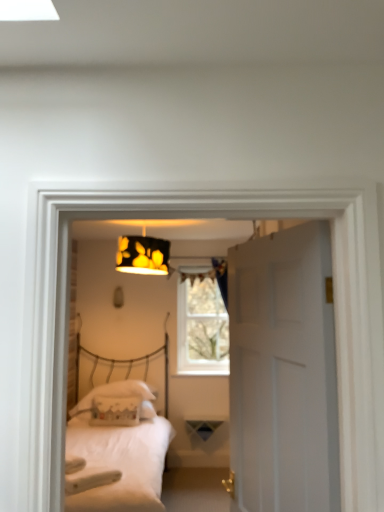
Question: Is white fabric pillow at center, the first pillow from the front, outside white matte door at center?

Choices:
 (A) yes
 (B) no

Answer: (A)

Question: Can you confirm if white fabric pillow at center, the first pillow from the front, is shorter than white matte door at center?

Choices:
 (A) yes
 (B) no

Answer: (A)

Question: Does white fabric pillow at center, the second pillow in the back-to-front sequence, turn towards white matte door at center?

Choices:
 (A) yes
 (B) no

Answer: (A)

Question: Is white matte door at center located within white fabric pillow at center, the second pillow in the back-to-front sequence?

Choices:
 (A) yes
 (B) no

Answer: (B)

Question: Is white fabric pillow at center, the second pillow in the back-to-front sequence, looking in the opposite direction of white matte door at center?

Choices:
 (A) yes
 (B) no

Answer: (B)

Question: Considering the positions of black paper lampshade at upper center and white fabric pillow at center, the 1th pillow when ordered from back to front, in the image, is black paper lampshade at upper center wider or thinner than white fabric pillow at center, the 1th pillow when ordered from back to front,?

Choices:
 (A) thin
 (B) wide

Answer: (A)

Question: Considering the positions of black paper lampshade at upper center and white fabric pillow at center, marked as the second pillow in a front-to-back arrangement, in the image, is black paper lampshade at upper center taller or shorter than white fabric pillow at center, marked as the second pillow in a front-to-back arrangement,?

Choices:
 (A) tall
 (B) short

Answer: (A)

Question: Is black paper lampshade at upper center in front of or behind white fabric pillow at center, the 1th pillow when ordered from back to front, in the image?

Choices:
 (A) behind
 (B) front

Answer: (B)

Question: From a real-world perspective, relative to white fabric pillow at center, marked as the second pillow in a front-to-back arrangement, is black paper lampshade at upper center vertically above or below?

Choices:
 (A) above
 (B) below

Answer: (A)

Question: In the image, is clear glass window at center on the left side or the right side of white fabric pillow at center, marked as the second pillow in a front-to-back arrangement?

Choices:
 (A) right
 (B) left

Answer: (A)

Question: From the image's perspective, is clear glass window at center positioned above or below white fabric pillow at center, the 1th pillow when ordered from back to front?

Choices:
 (A) below
 (B) above

Answer: (B)

Question: In terms of size, does clear glass window at center appear bigger or smaller than white fabric pillow at center, the 1th pillow when ordered from back to front?

Choices:
 (A) big
 (B) small

Answer: (B)

Question: Is clear glass window at center inside or outside of white fabric pillow at center, marked as the second pillow in a front-to-back arrangement?

Choices:
 (A) outside
 (B) inside

Answer: (A)

Question: In terms of size, does white fabric pillow at center, the 1th pillow when ordered from back to front, appear bigger or smaller than white matte bed at center?

Choices:
 (A) big
 (B) small

Answer: (B)

Question: Is point (140, 413) positioned closer to the camera than point (96, 432)?

Choices:
 (A) closer
 (B) farther

Answer: (B)